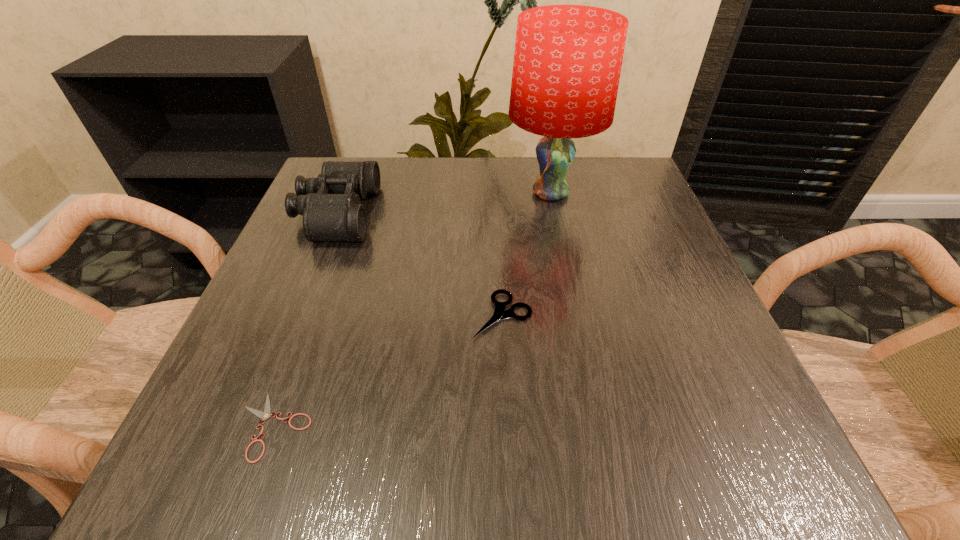
Locate an element on the screen. lampshade that is positioned at the far edge is located at coordinates (567, 63).

In order to click on binoculars present at the far edge in this screenshot , I will do `click(330, 204)`.

The width and height of the screenshot is (960, 540). I want to click on object that is at the near edge, so click(x=265, y=415).

Identify the location of binoculars at the left edge. The width and height of the screenshot is (960, 540). (330, 204).

At what (x,y) coordinates should I click in order to perform the action: click on shears that is at the left edge. Please return your answer as a coordinate pair (x, y). Looking at the image, I should click on (265, 415).

Where is `object at the right edge`? Image resolution: width=960 pixels, height=540 pixels. object at the right edge is located at coordinates (567, 63).

You are a GUI agent. You are given a task and a screenshot of the screen. Output one action in this format:
    pyautogui.click(x=<x>, y=<y>)
    Task: Click on the object that is at the far left corner
    
    Given the screenshot: What is the action you would take?
    pyautogui.click(x=330, y=204)

Identify the location of object located in the near left corner section of the desktop. (265, 415).

In order to click on object that is at the far right corner in this screenshot , I will do `click(567, 63)`.

The height and width of the screenshot is (540, 960). In order to click on free location at the far edge in this screenshot , I will do `click(471, 162)`.